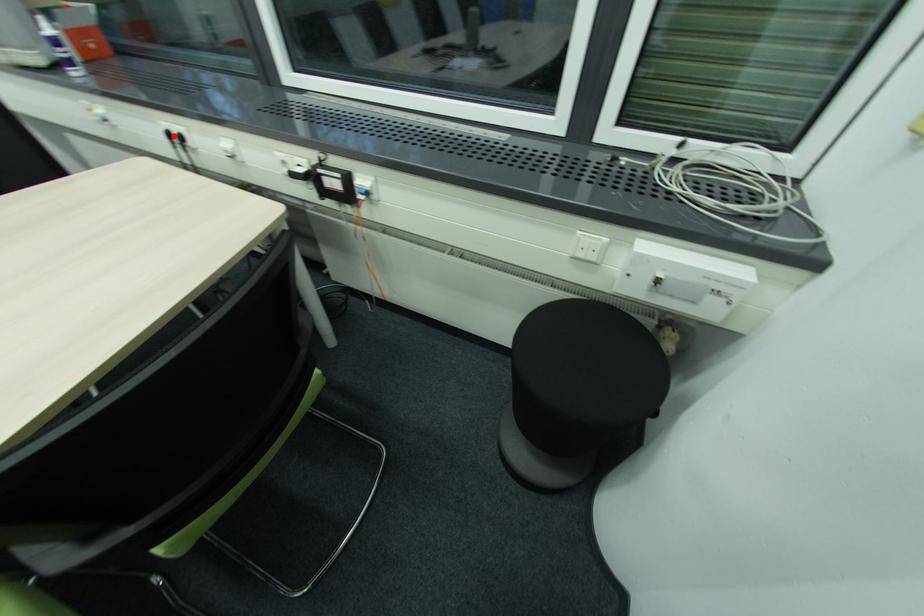
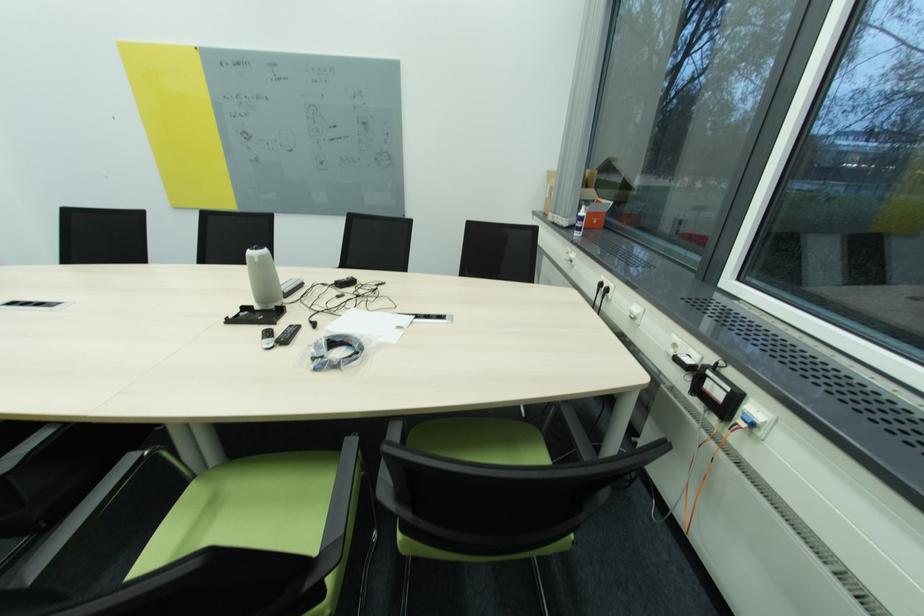
Question: I am providing you with two images of the same scene from different viewpoints. In image1, a red point is highlighted. Considering the same 3D point in image2, which of the following is correct?

Choices:
 (A) It is closer
 (B) It is farther

Answer: (A)